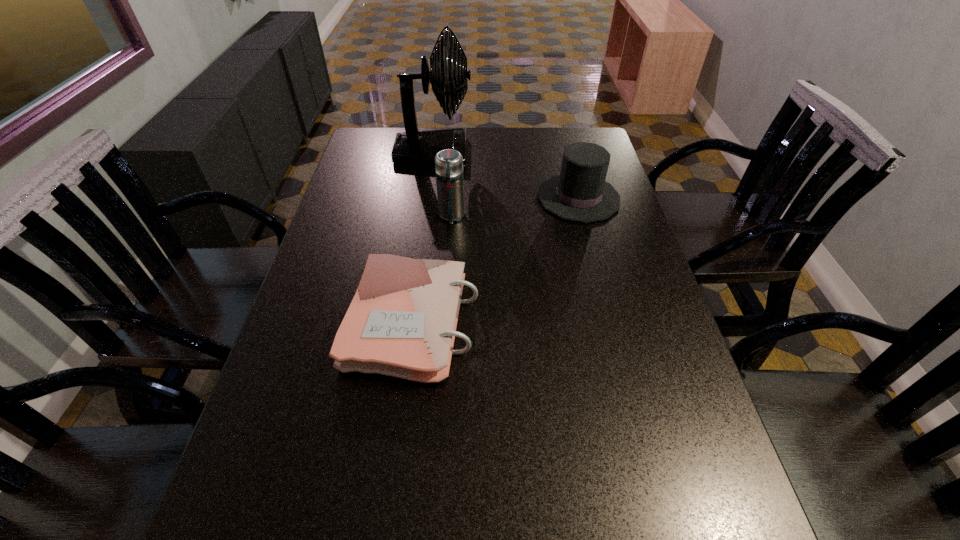
Identify the location of free space located 0.070m on the front of the rightmost object with the decoration. (515, 198).

Find the location of `free region located on the right of the shortest object`. free region located on the right of the shortest object is located at coordinates (637, 322).

At what (x,y) coordinates should I click in order to perform the action: click on object present at the far edge. Please return your answer as a coordinate pair (x, y). The width and height of the screenshot is (960, 540). Looking at the image, I should click on (416, 147).

Identify the location of fan situated at the left edge. (416, 147).

Locate an element on the screen. The image size is (960, 540). phonebook that is at the left edge is located at coordinates (402, 320).

The width and height of the screenshot is (960, 540). In order to click on object positioned at the right edge in this screenshot , I will do coord(579,193).

Locate an element on the screen. This screenshot has height=540, width=960. object present at the far left corner is located at coordinates (416, 147).

This screenshot has width=960, height=540. I want to click on vacant region at the far edge of the desktop, so click(x=509, y=134).

Identify the location of free region at the left edge of the desktop. (395, 164).

Locate an element on the screen. The height and width of the screenshot is (540, 960). vacant region at the right edge of the desktop is located at coordinates (642, 429).